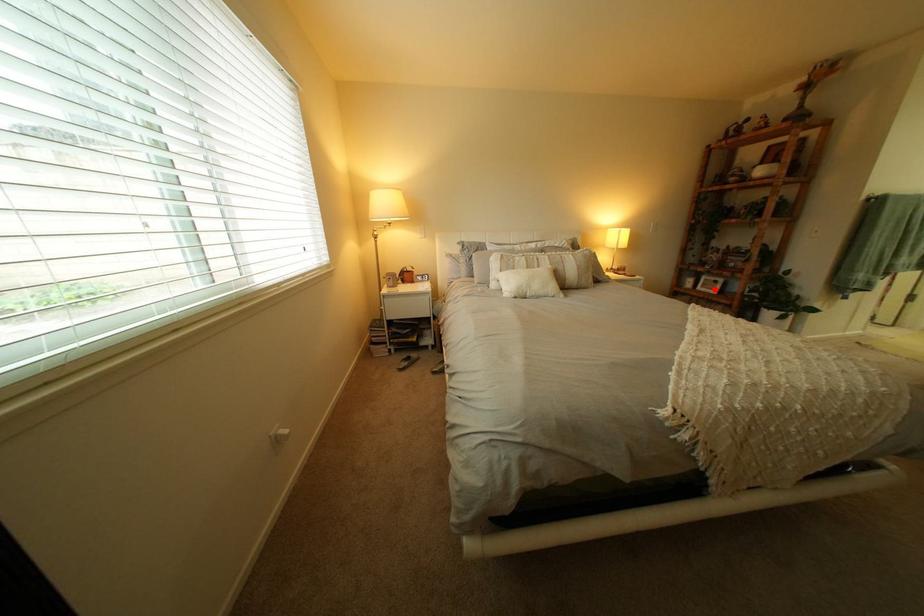
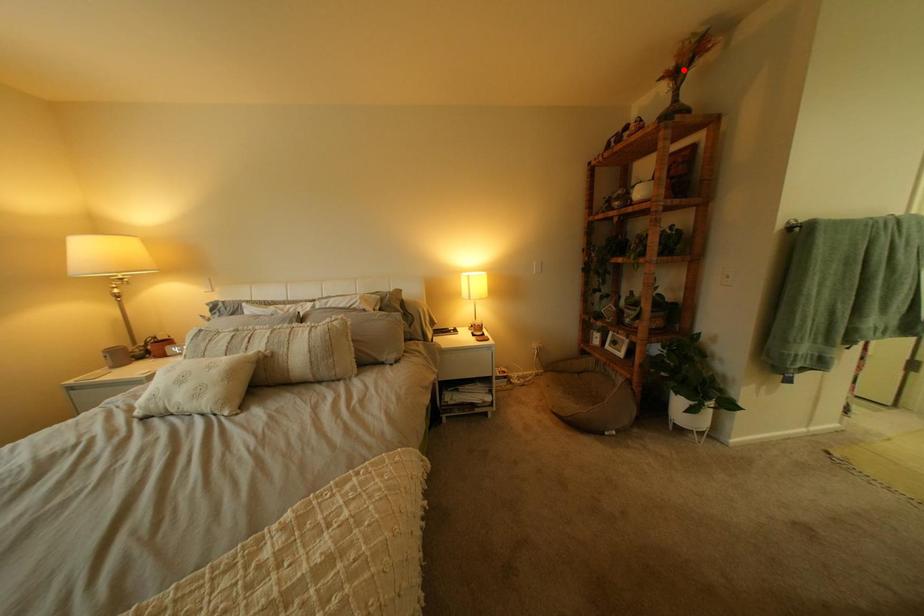
I am providing you with two images of the same scene from different viewpoints. A red point is marked on the first image and another point is marked on the second image. Does the point marked in image1 correspond to the same location as the one in image2?

No